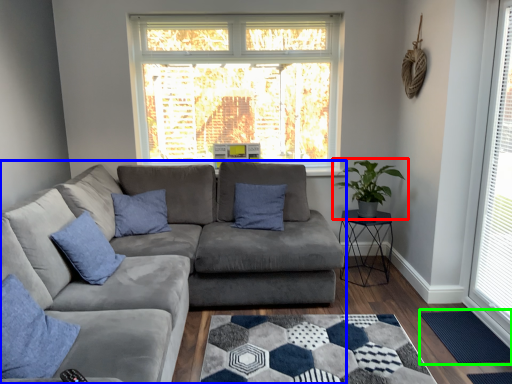
Question: Estimate the real-world distances between objects in this image. Which object is closer to houseplant (highlighted by a red box), studio couch (highlighted by a blue box) or mat (highlighted by a green box)?

Choices:
 (A) studio couch
 (B) mat

Answer: (B)